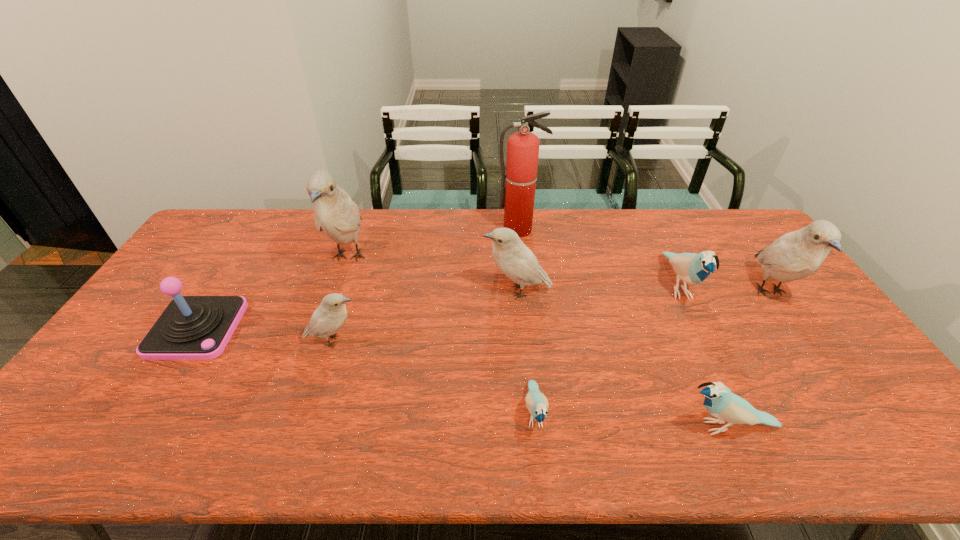
This screenshot has width=960, height=540. I want to click on the closest white bird to the third biggest white bird, so click(329, 317).

Identify the location of blue bird that is the second closest to the tallest bird. (720, 402).

Image resolution: width=960 pixels, height=540 pixels. Find the location of `the second closest blue bird to the shortest bird`. the second closest blue bird to the shortest bird is located at coordinates (693, 268).

Where is `free spot that satisfies the following two spatial constraints: 1. at the beak of the second biggest white bird; 2. at the beak of the smallest white bird`? free spot that satisfies the following two spatial constraints: 1. at the beak of the second biggest white bird; 2. at the beak of the smallest white bird is located at coordinates (804, 341).

Where is `free space that satisfies the following two spatial constraints: 1. at the face of the farthest blue bird; 2. at the face of the second biggest blue bird`? free space that satisfies the following two spatial constraints: 1. at the face of the farthest blue bird; 2. at the face of the second biggest blue bird is located at coordinates (746, 427).

Image resolution: width=960 pixels, height=540 pixels. Identify the location of vacant area in the image that satisfies the following two spatial constraints: 1. at the beak of the sixth shortest bird; 2. at the beak of the fifth farthest bird. (804, 341).